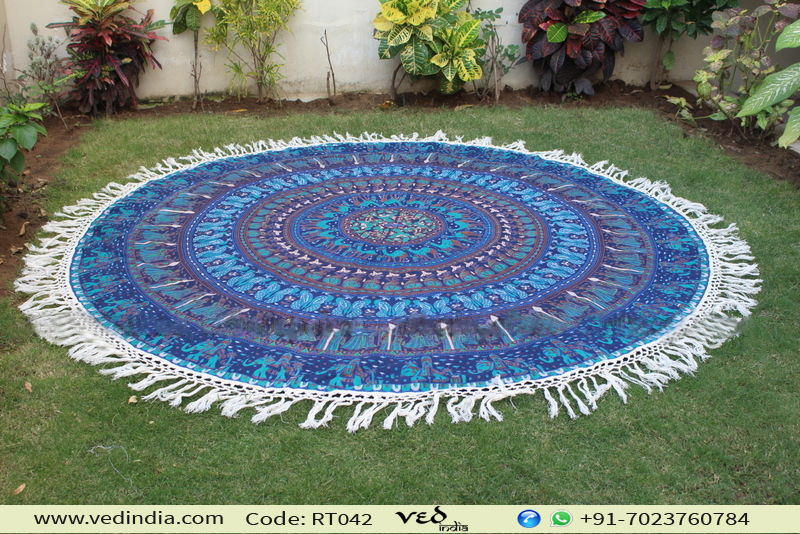
You are a GUI agent. You are given a task and a screenshot of the screen. Output one action in this format:
    pyautogui.click(x=<x>, y=<y>)
    Task: Click on the rug
    The height and width of the screenshot is (534, 800).
    Given the screenshot: What is the action you would take?
    pyautogui.click(x=392, y=237)